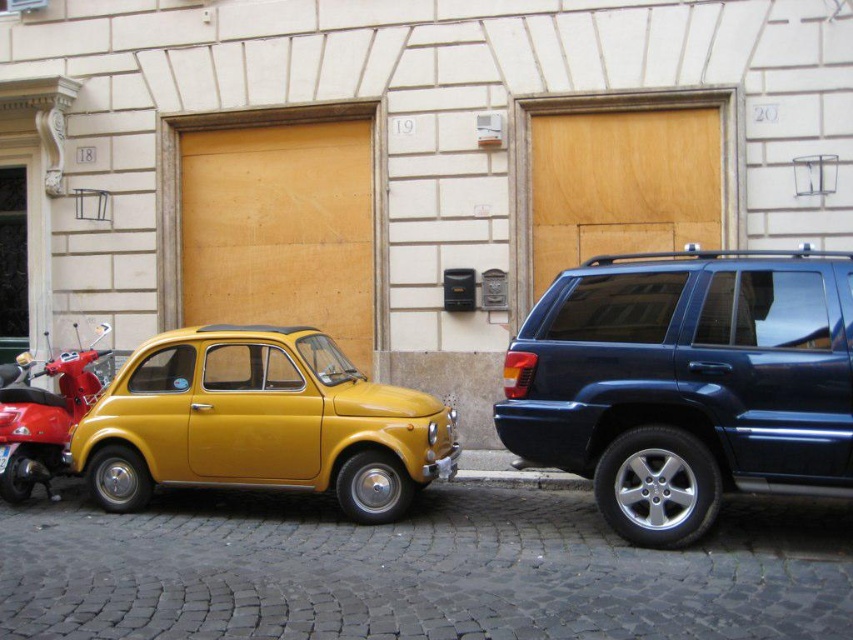
You are a pedestrian standing at the center of the cobblestone street. You need to walk to the shiny dark blue minivan at right. Which direction should you walk to avoid the shiny red scooter at left?

The shiny dark blue minivan at right is to the right of the shiny red scooter at left. Therefore, to reach the shiny dark blue minivan at right while avoiding the shiny red scooter at left, you should walk to the right side of the street.

You are a delivery person trying to park a truck that is 3 meters wide. You see the shiny dark blue minivan at right and the yellow matte car at center parked on the street. Can you fit your truck between them?

The shiny dark blue minivan at right is narrower than the yellow matte car at center, but without knowing the exact distance between them, it is impossible to determine if the truck can fit. You should check the space between the two vehicles first.